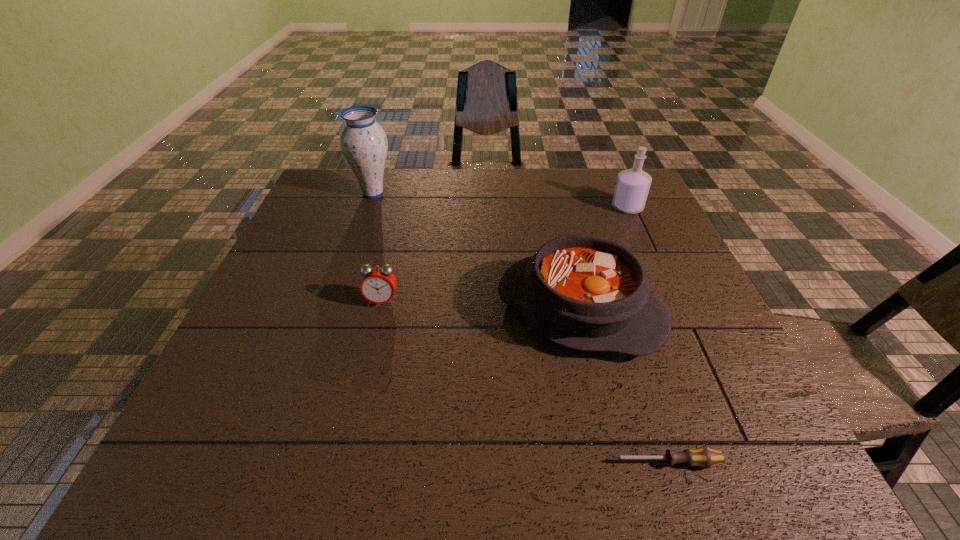
Find the location of `vacant space that satisfies the following two spatial constraints: 1. on the front side of the second tallest object; 2. on the left side of the leftmost object`. vacant space that satisfies the following two spatial constraints: 1. on the front side of the second tallest object; 2. on the left side of the leftmost object is located at coordinates (369, 207).

Where is `free spot that satisfies the following two spatial constraints: 1. on the front side of the leftmost object; 2. on the left side of the third shortest object`? This screenshot has width=960, height=540. free spot that satisfies the following two spatial constraints: 1. on the front side of the leftmost object; 2. on the left side of the third shortest object is located at coordinates (334, 310).

In order to click on vacant space that satisfies the following two spatial constraints: 1. on the front side of the perfume; 2. at the tip of the screwdriver in this screenshot , I will do point(741,462).